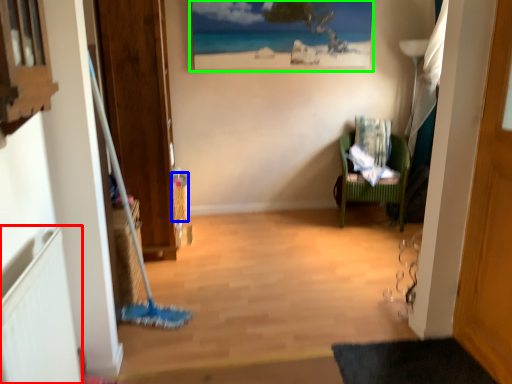
Question: Based on their relative distances, which object is nearer to radiator (highlighted by a red box)? Choose from picnic basket (highlighted by a blue box) and picture frame (highlighted by a green box).

Choices:
 (A) picnic basket
 (B) picture frame

Answer: (A)